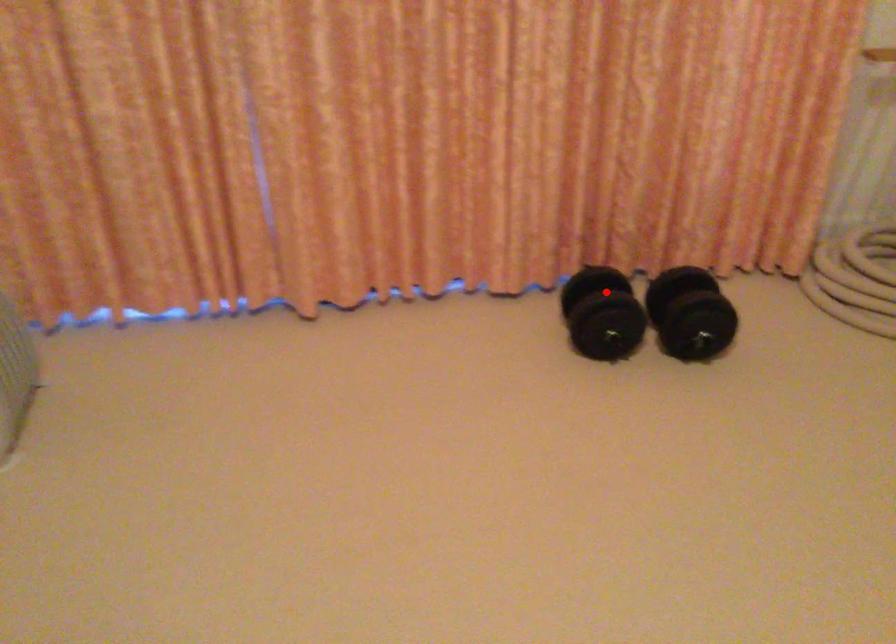
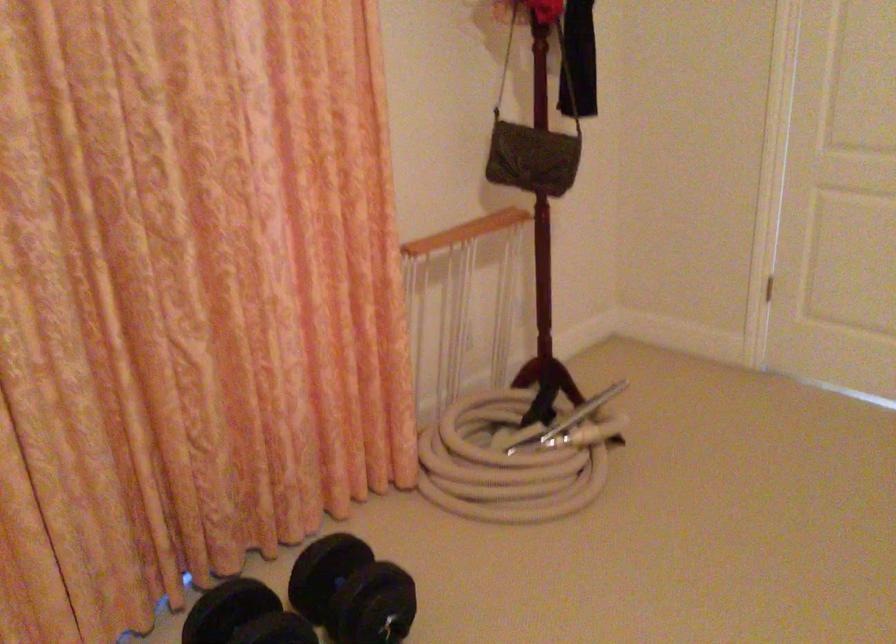
Question: I am providing you with two images of the same scene from different viewpoints. A red point is shown in image1. For the corresponding object point in image2, is it positioned nearer or farther from the camera?

Choices:
 (A) Nearer
 (B) Farther

Answer: (A)